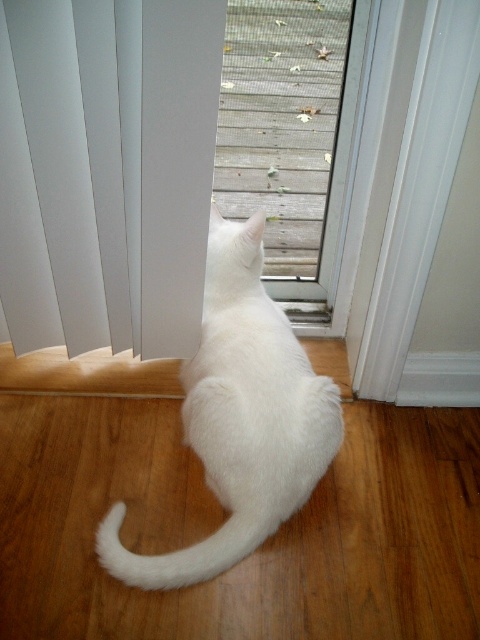
Question: Among these points, which one is farthest from the camera?

Choices:
 (A) (159, 564)
 (B) (34, 97)
 (C) (319, 417)

Answer: (C)

Question: Is white fluffy cat at center positioned at the back of white fluffy tail at lower center?

Choices:
 (A) no
 (B) yes

Answer: (B)

Question: Can you confirm if white fluffy cat at center is positioned above white fluffy tail at lower center?

Choices:
 (A) yes
 (B) no

Answer: (A)

Question: Which object is farther from the camera taking this photo?

Choices:
 (A) white fluffy cat at center
 (B) white matte blinds at center

Answer: (A)

Question: Based on their relative distances, which object is farther from the white matte blinds at center?

Choices:
 (A) white fluffy tail at lower center
 (B) white fluffy cat at center

Answer: (A)

Question: Can you confirm if white matte blinds at center is positioned above white fluffy tail at lower center?

Choices:
 (A) no
 (B) yes

Answer: (B)